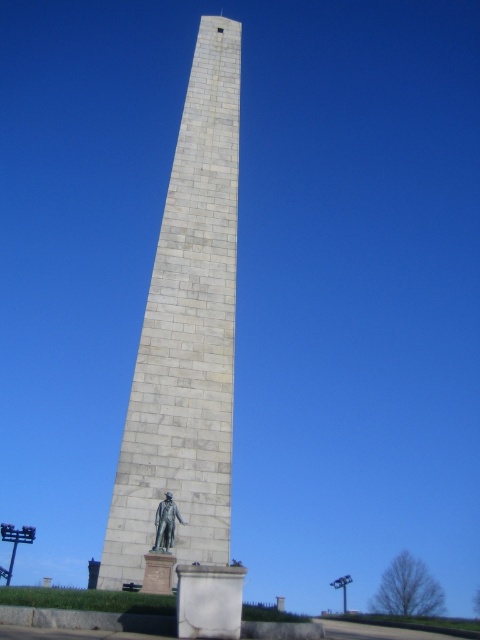
You are a photographer planning to capture the white stone obelisk at center and the bronze statue at lower center in a single frame. Considering their heights, which object will appear taller in the photograph?

The white stone obelisk at center will appear taller in the photograph because it has a greater height compared to the bronze statue at lower center.

You are standing at the center of a grassy field and see the white stone obelisk at center. If you walk straight ahead, will you reach the obelisk before reaching the edge of the field?

The white stone obelisk at center is located at point (x=187, y=336), which is closer to the center than the edge of the field. Therefore, walking straight ahead from the center would reach the obelisk before the edge of the field.